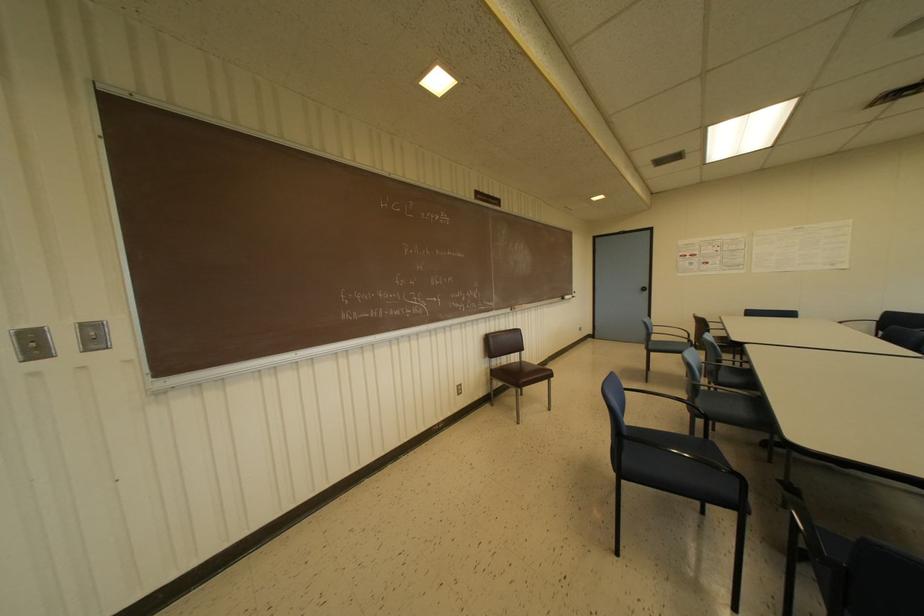
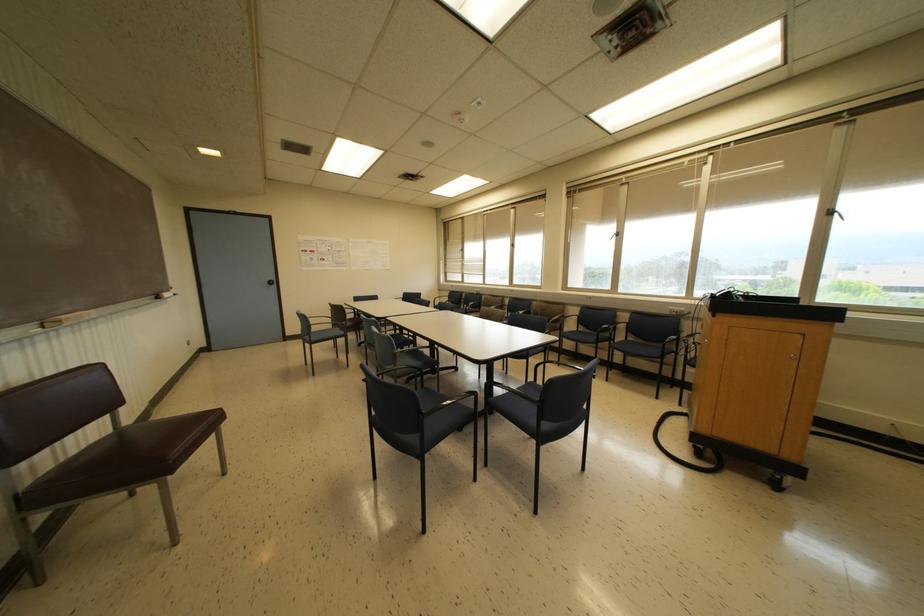
Where in the second image is the point corresponding to [650,346] from the first image?

(312, 338)